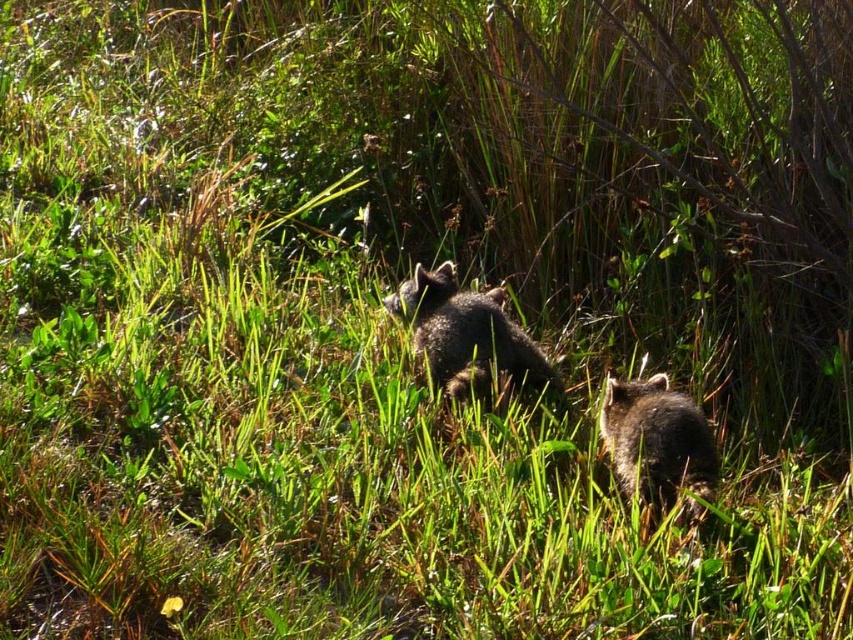
Question: Does fuzzy brown fox at center lie behind fuzzy brown raccoon at lower right?

Choices:
 (A) yes
 (B) no

Answer: (A)

Question: Does fuzzy brown fox at center appear over fuzzy brown raccoon at lower right?

Choices:
 (A) yes
 (B) no

Answer: (A)

Question: Is fuzzy brown fox at center above fuzzy brown raccoon at lower right?

Choices:
 (A) yes
 (B) no

Answer: (A)